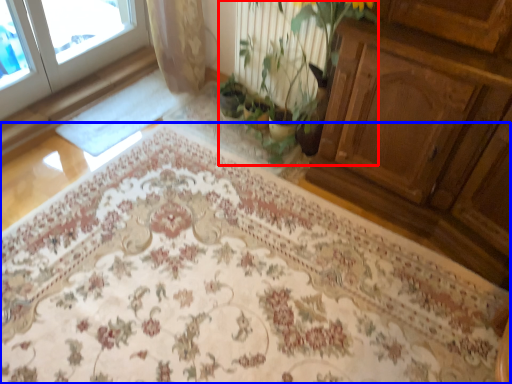
Question: Which object is closer to the camera taking this photo, floral arrangement (highlighted by a red box) or mat (highlighted by a blue box)?

Choices:
 (A) floral arrangement
 (B) mat

Answer: (B)